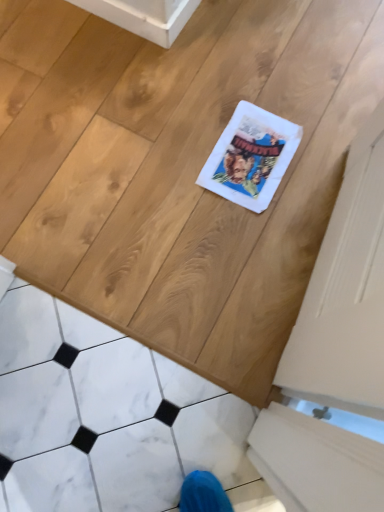
At what (x,y) coordinates should I click in order to perform the action: click on free region on the left part of white matte screen door at right. Please return your answer as a coordinate pair (x, y). Looking at the image, I should click on (193, 230).